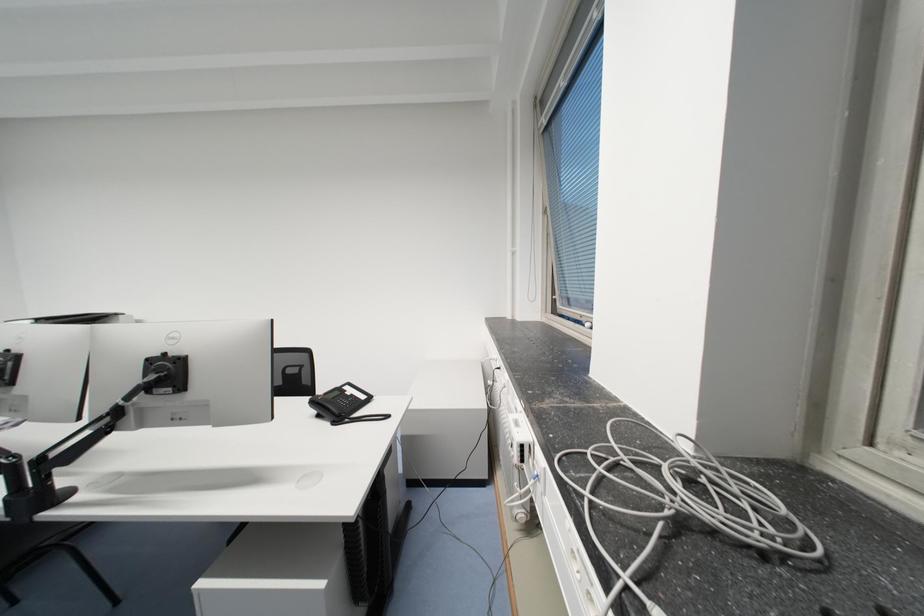
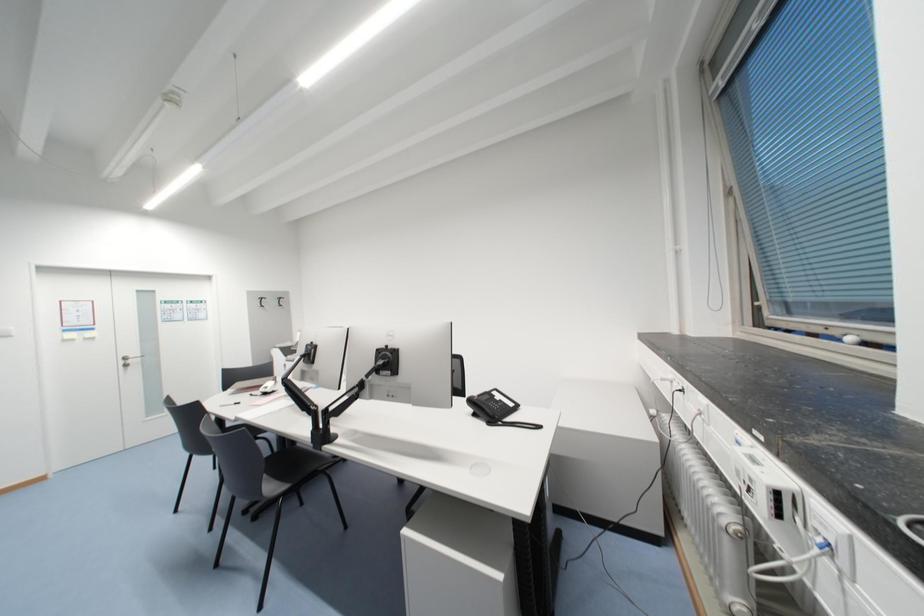
Question: The camera is either moving clockwise (left) or counter-clockwise (right) around the object. The first image is from the beginning of the video and the second image is from the end. Is the camera moving left or right when shooting the video?

Choices:
 (A) Left
 (B) Right

Answer: (B)